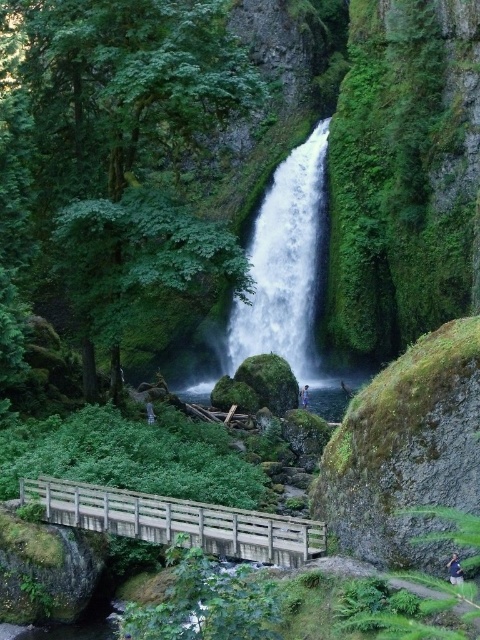
Question: Which of the following is the closest to the observer?

Choices:
 (A) wooden bridge at lower center
 (B) white smooth waterfall at center
 (C) green fabric shirt at center

Answer: (A)

Question: Is white smooth waterfall at center thinner than green fabric shirt at center?

Choices:
 (A) yes
 (B) no

Answer: (B)

Question: Which point is farther to the camera?

Choices:
 (A) (303, 397)
 (B) (295, 243)
 (C) (69, 520)

Answer: (B)

Question: From the image, what is the correct spatial relationship of wooden bridge at lower center in relation to green fabric shirt at center?

Choices:
 (A) right
 (B) left

Answer: (B)

Question: Estimate the real-world distances between objects in this image. Which object is closer to the white smooth waterfall at center?

Choices:
 (A) green fabric shirt at center
 (B) light blue denim jeans at center
 (C) wooden bridge at lower center

Answer: (B)

Question: From the image, what is the correct spatial relationship of wooden bridge at lower center in relation to light blue denim jeans at center?

Choices:
 (A) left
 (B) right

Answer: (A)